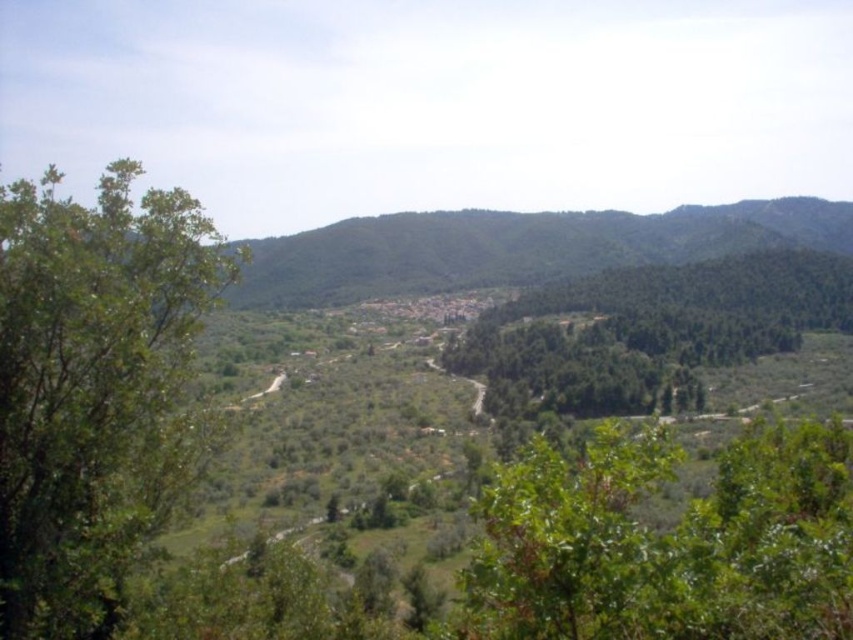
Can you confirm if green leafy tree at left is positioned to the right of green leafy tree at center?

In fact, green leafy tree at left is to the left of green leafy tree at center.

At what (x,y) coordinates should I click in order to perform the action: click on green leafy tree at left. Please return your answer as a coordinate pair (x, y). The width and height of the screenshot is (853, 640). Looking at the image, I should click on (94, 388).

Is point (62, 227) behind point (782, 349)?

No, (62, 227) is in front of (782, 349).

Does point (192, 428) come in front of point (822, 310)?

Yes, point (192, 428) is in front of point (822, 310).

Identify the location of green leafy tree at left. [x=94, y=388].

Locate an element on the screen. green leafy tree at left is located at coordinates (94, 388).

Is point (601, 451) positioned before point (611, 403)?

Yes.

Does green leafy tree at center appear on the right side of green leafy trees at center?

No, green leafy tree at center is not to the right of green leafy trees at center.

Find the location of a particular element. Image resolution: width=853 pixels, height=640 pixels. green leafy tree at center is located at coordinates 668,541.

Where is `green leafy tree at center`? Image resolution: width=853 pixels, height=640 pixels. green leafy tree at center is located at coordinates coord(668,541).